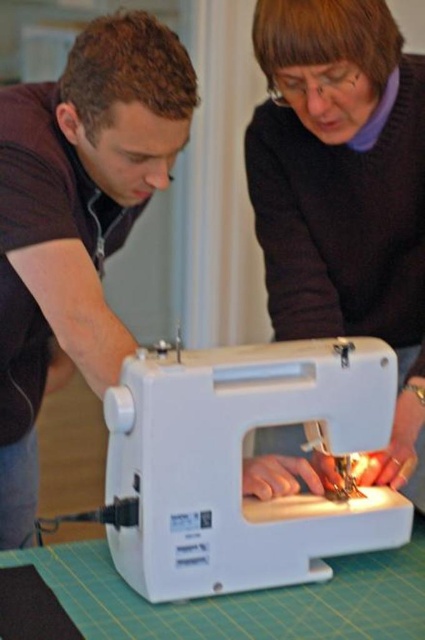
Is point (255, 208) more distant than point (118, 326)?

Yes, point (255, 208) is behind point (118, 326).

Does matte black sewing machine at center have a greater height compared to matte black sewing machine at left?

Incorrect, matte black sewing machine at center's height is not larger of matte black sewing machine at left's.

This screenshot has width=425, height=640. In order to click on matte black sewing machine at center in this screenshot , I will do [343, 189].

Is matte black sewing machine at center shorter than green cutting mat at lower center?

In fact, matte black sewing machine at center may be taller than green cutting mat at lower center.

Does point (303, 8) come in front of point (124, 586)?

No, it is not.

Image resolution: width=425 pixels, height=640 pixels. What do you see at coordinates (343, 189) in the screenshot?
I see `matte black sewing machine at center` at bounding box center [343, 189].

Image resolution: width=425 pixels, height=640 pixels. What are the coordinates of `matte black sewing machine at center` in the screenshot? It's located at (343, 189).

Is white plastic sewing machine at center bigger than matte black sewing machine at left?

Incorrect, white plastic sewing machine at center is not larger than matte black sewing machine at left.

Locate an element on the screen. This screenshot has width=425, height=640. white plastic sewing machine at center is located at coordinates (240, 465).

Where is `white plastic sewing machine at center`? The height and width of the screenshot is (640, 425). white plastic sewing machine at center is located at coordinates (240, 465).

Find the location of a particular element. This screenshot has height=640, width=425. white plastic sewing machine at center is located at coordinates (240, 465).